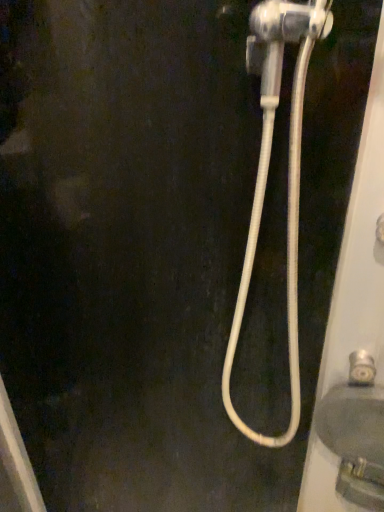
Question: Is silver metallic faucet at lower right wider or thinner than matte gray sink at lower right?

Choices:
 (A) thin
 (B) wide

Answer: (A)

Question: In terms of size, does silver metallic faucet at lower right appear bigger or smaller than matte gray sink at lower right?

Choices:
 (A) small
 (B) big

Answer: (A)

Question: Based on their relative distances, which object is nearer to the silver metallic faucet at lower right?

Choices:
 (A) white rubber hose at right
 (B) matte gray sink at lower right

Answer: (B)

Question: Based on their relative distances, which object is nearer to the matte gray sink at lower right?

Choices:
 (A) silver metallic faucet at lower right
 (B) white rubber hose at right

Answer: (A)